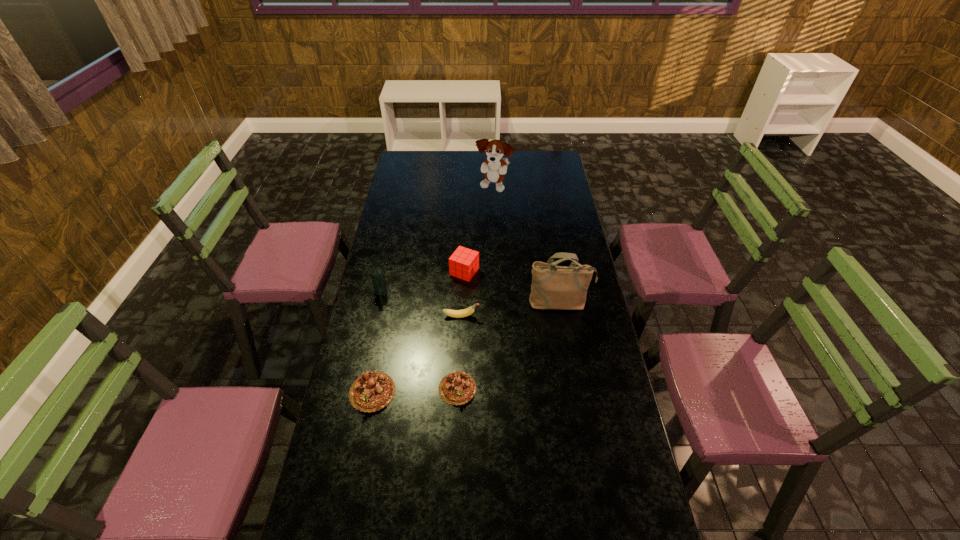
Identify the location of free space located on the back of the right chocolate cake. The width and height of the screenshot is (960, 540). (461, 309).

You are a GUI agent. You are given a task and a screenshot of the screen. Output one action in this format:
    pyautogui.click(x=<x>, y=<y>)
    Task: Click on the vacant space located 0.050m on the face of the farthest object
    The width and height of the screenshot is (960, 540).
    Given the screenshot: What is the action you would take?
    pyautogui.click(x=494, y=204)

At what (x,y) coordinates should I click in order to perform the action: click on free space located on the back of the fifth shortest object. Please return your answer as a coordinate pair (x, y). Looking at the image, I should click on (390, 252).

The height and width of the screenshot is (540, 960). I want to click on vacant space located 0.270m at the stem of the banana, so click(550, 316).

Image resolution: width=960 pixels, height=540 pixels. In order to click on free space located 0.110m on the left of the fourth tallest object in this screenshot , I will do `click(423, 272)`.

What are the coordinates of `vacant space situated on the front-facing side of the shoulder bag` in the screenshot? It's located at (571, 367).

At what (x,y) coordinates should I click in order to perform the action: click on chocolate cake present at the left edge. Please return your answer as a coordinate pair (x, y). The image size is (960, 540). Looking at the image, I should click on (372, 391).

I want to click on vodka that is at the left edge, so click(378, 279).

I want to click on object located at the right edge, so click(555, 287).

Image resolution: width=960 pixels, height=540 pixels. In order to click on blank area at the far edge in this screenshot , I will do `click(429, 161)`.